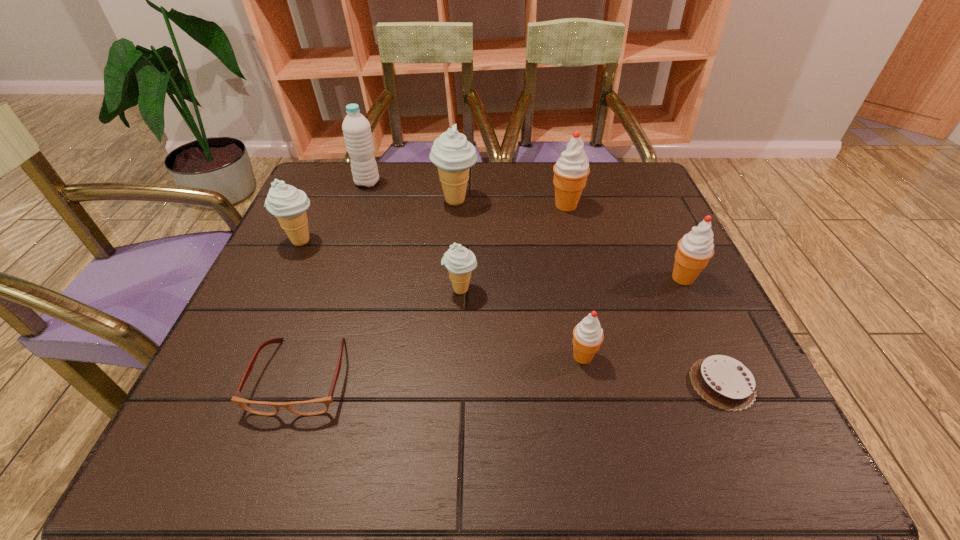
Locate an element on the screen. vacant space positioned on the front-facing side of the brown spectacles is located at coordinates (273, 462).

Identify the location of free space located 0.390m on the left of the shortest object. The image size is (960, 540). (469, 383).

Where is `water bottle at the far edge`? water bottle at the far edge is located at coordinates pos(356,128).

Image resolution: width=960 pixels, height=540 pixels. Identify the location of object at the near edge. 317,406.

The height and width of the screenshot is (540, 960). I want to click on water bottle at the left edge, so click(356, 128).

Locate an element on the screen. This screenshot has height=540, width=960. icecream present at the left edge is located at coordinates (288, 204).

Locate an element on the screen. The image size is (960, 540). spectacles situated at the left edge is located at coordinates (x=317, y=406).

At what (x,y) coordinates should I click in order to perform the action: click on icecream that is at the right edge. Please return your answer as a coordinate pair (x, y). Image resolution: width=960 pixels, height=540 pixels. Looking at the image, I should click on (694, 250).

What are the coordinates of `chocolate cake positioned at the right edge` in the screenshot? It's located at (726, 383).

In order to click on object that is at the far left corner in this screenshot , I will do `click(356, 128)`.